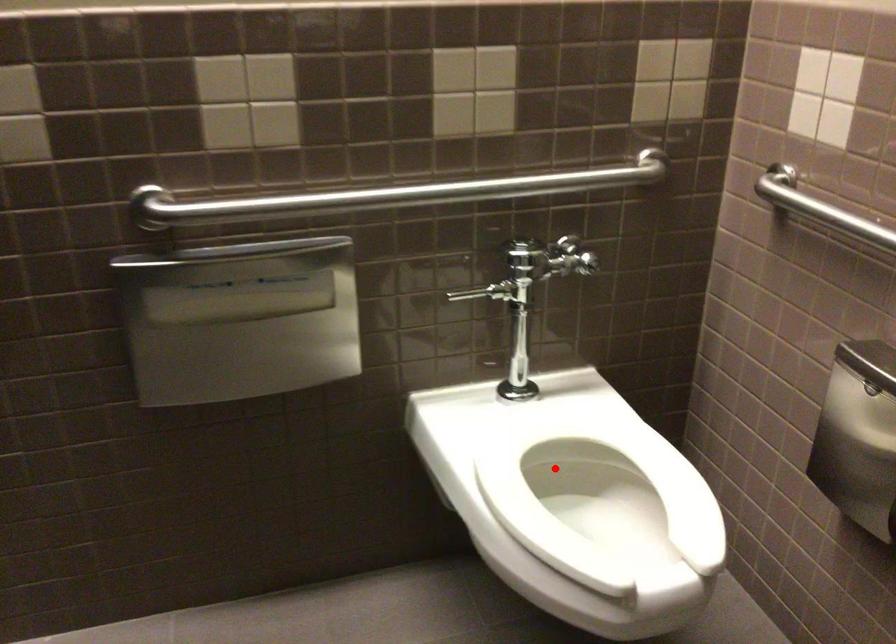
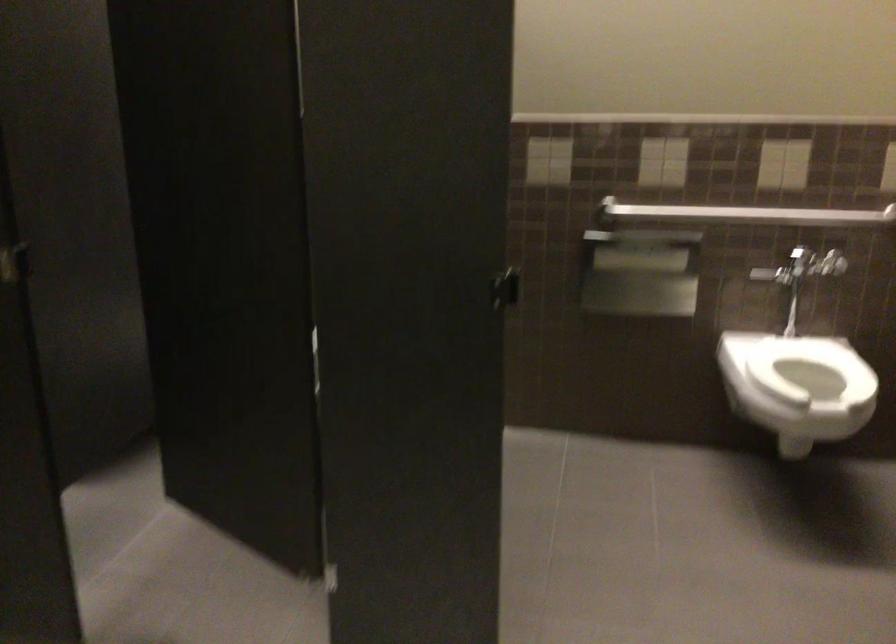
Locate, in the second image, the point that corresponds to the highlighted location in the first image.

(810, 368)